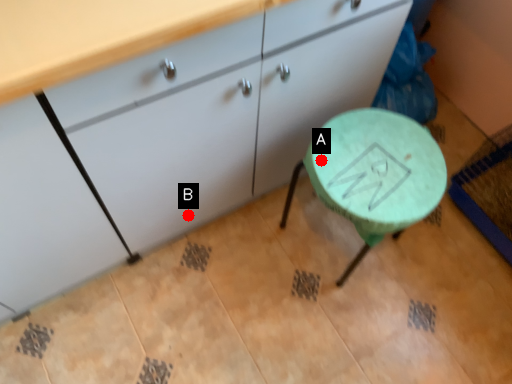
Question: Two points are circled on the image, labeled by A and B beside each circle. Which point is further to the camera?

Choices:
 (A) A is further
 (B) B is further

Answer: (B)